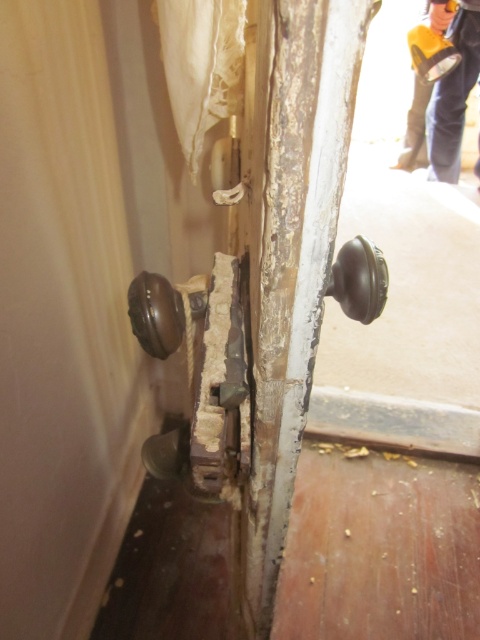
Question: Which object is the closest to the shiny dark brown knob at right?

Choices:
 (A) shiny dark brown knob at lower left
 (B) orange fabric pants at upper right
 (C) matte brown door handle at lower left
 (D) matte brown door handle at center

Answer: (A)

Question: Does shiny dark brown knob at right appear over shiny dark brown knob at lower left?

Choices:
 (A) no
 (B) yes

Answer: (B)

Question: Which point is closer to the camera taking this photo?

Choices:
 (A) (188, 429)
 (B) (158, 522)

Answer: (A)

Question: Which point is farther to the camera?

Choices:
 (A) (175, 301)
 (B) (255, 132)
 (C) (455, 157)

Answer: (C)

Question: Does matte brown door handle at center have a smaller size compared to orange fabric pants at upper right?

Choices:
 (A) yes
 (B) no

Answer: (B)

Question: Does matte brown door handle at center appear on the left side of matte brown door handle at lower left?

Choices:
 (A) yes
 (B) no

Answer: (B)